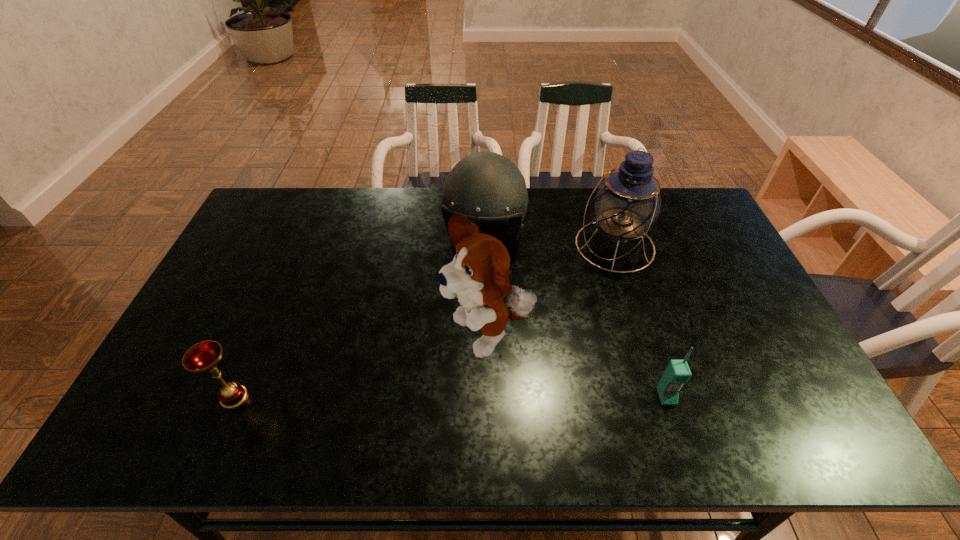
In the image, there is a desktop. Where is `vacant area at the far edge`? The height and width of the screenshot is (540, 960). vacant area at the far edge is located at coordinates (331, 213).

Locate an element on the screen. free space at the near edge is located at coordinates (587, 390).

The image size is (960, 540). What are the coordinates of `vacant space at the left edge of the desktop` in the screenshot? It's located at (222, 306).

Where is `vacant space at the far left corner of the desktop`? This screenshot has width=960, height=540. vacant space at the far left corner of the desktop is located at coordinates (254, 213).

Where is `free point at the far right corner`? This screenshot has width=960, height=540. free point at the far right corner is located at coordinates (706, 211).

Where is `free area in between the leftmost object and the third tallest object`? The image size is (960, 540). free area in between the leftmost object and the third tallest object is located at coordinates (359, 316).

Where is `vacant space in between the puppy and the lantern`? This screenshot has width=960, height=540. vacant space in between the puppy and the lantern is located at coordinates (551, 293).

Where is `free space that is in between the chalice and the football helmet`? The width and height of the screenshot is (960, 540). free space that is in between the chalice and the football helmet is located at coordinates (359, 316).

What are the coordinates of `vacant point located between the third farthest object and the lantern` in the screenshot? It's located at (551, 293).

I want to click on empty location between the leftmost object and the cellular telephone, so click(x=450, y=397).